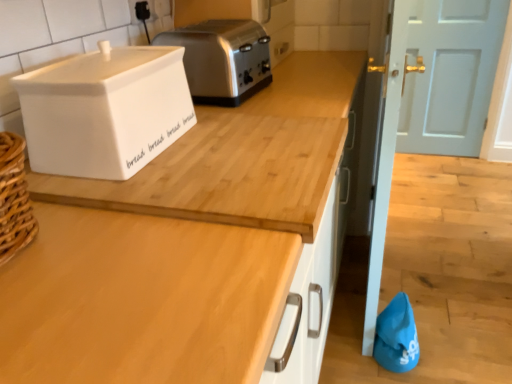
Describe the element at coordinates (222, 59) in the screenshot. I see `satin silver toaster at upper center` at that location.

What do you see at coordinates (105, 111) in the screenshot? I see `white ceramic bread bin at upper left` at bounding box center [105, 111].

Identify the location of white ceramic bread bin at upper left. (105, 111).

Find the location of `light blue painted wood door at upper right`. light blue painted wood door at upper right is located at coordinates (450, 75).

Find the location of a particular element. This screenshot has height=384, width=512. countertop in front of the light blue painted wood door at upper right is located at coordinates (190, 247).

From the image's perspective, would you say light blue painted wood door at upper right is shown under wooden at upper center?

Actually, light blue painted wood door at upper right appears above wooden at upper center in the image.

Considering the sizes of objects light blue painted wood door at upper right and wooden at upper center in the image provided, who is taller, light blue painted wood door at upper right or wooden at upper center?

Standing taller between the two is light blue painted wood door at upper right.

Is light blue painted wood door at upper right at the right side of wooden at upper center?

Yes, light blue painted wood door at upper right is to the right of wooden at upper center.

Based on the photo, considering the positions of objects white ceramic bread bin at upper left and satin silver toaster at upper center in the image provided, who is in front, white ceramic bread bin at upper left or satin silver toaster at upper center?

white ceramic bread bin at upper left.

From a real-world perspective, is white ceramic bread bin at upper left beneath satin silver toaster at upper center?

Actually, white ceramic bread bin at upper left is physically above satin silver toaster at upper center in the real world.

Does white ceramic bread bin at upper left have a lesser height compared to satin silver toaster at upper center?

No.

From the image's perspective, is satin silver toaster at upper center above light blue painted wood door at upper right?

No, from the image's perspective, satin silver toaster at upper center is not on top of light blue painted wood door at upper right.

Locate an element on the screen. door behind the satin silver toaster at upper center is located at coordinates (450, 75).

Based on the photo, considering the sizes of satin silver toaster at upper center and light blue painted wood door at upper right in the image, is satin silver toaster at upper center wider or thinner than light blue painted wood door at upper right?

Considering their sizes, satin silver toaster at upper center looks broader than light blue painted wood door at upper right.

Between light blue painted wood door at upper right and white ceramic bread bin at upper left, which one has more height?

Standing taller between the two is light blue painted wood door at upper right.

From the picture: Between light blue painted wood door at upper right and white ceramic bread bin at upper left, which one is positioned behind?

light blue painted wood door at upper right is further away from the camera.

Considering the relative positions of light blue painted wood door at upper right and white ceramic bread bin at upper left in the image provided, is light blue painted wood door at upper right to the left of white ceramic bread bin at upper left from the viewer's perspective?

In fact, light blue painted wood door at upper right is to the right of white ceramic bread bin at upper left.

Would you say wooden at upper center is inside or outside white ceramic bread bin at upper left?

wooden at upper center lies outside white ceramic bread bin at upper left.

Is wooden at upper center aimed at white ceramic bread bin at upper left?

No, wooden at upper center is not oriented towards white ceramic bread bin at upper left.

Is point (106, 252) positioned after point (68, 111)?

No.

At what (x,y) coordinates should I click in order to perform the action: click on countertop located below the white ceramic bread bin at upper left (from the image's perspective). Please return your answer as a coordinate pair (x, y). This screenshot has width=512, height=384. Looking at the image, I should click on (190, 247).

Is satin silver toaster at upper center positioned beyond the bounds of wooden at upper center?

Yes, satin silver toaster at upper center is not within wooden at upper center.

Based on the photo, does satin silver toaster at upper center appear on the left side of wooden at upper center?

Indeed, satin silver toaster at upper center is positioned on the left side of wooden at upper center.

Is satin silver toaster at upper center aimed at wooden at upper center?

No, satin silver toaster at upper center does not turn towards wooden at upper center.

Which is nearer, (249,36) or (310,237)?

Point (249,36) is positioned farther from the camera compared to point (310,237).

Choose the correct answer: Is white ceramic bread bin at upper left inside light blue painted wood door at upper right or outside it?

white ceramic bread bin at upper left is spatially situated outside light blue painted wood door at upper right.

Does white ceramic bread bin at upper left turn towards light blue painted wood door at upper right?

No, white ceramic bread bin at upper left is not oriented towards light blue painted wood door at upper right.

Based on the photo, is white ceramic bread bin at upper left at the left side of light blue painted wood door at upper right?

Yes.

This screenshot has height=384, width=512. What are the coordinates of `door that is behind the wooden at upper center` in the screenshot? It's located at (450, 75).

At what (x,y) coordinates should I click in order to perform the action: click on home appliance in front of the satin silver toaster at upper center. Please return your answer as a coordinate pair (x, y). Looking at the image, I should click on (105, 111).

Estimate the real-world distances between objects in this image. Which object is further from light blue painted wood door at upper right, white ceramic bread bin at upper left or wooden at upper center?

The object further to light blue painted wood door at upper right is white ceramic bread bin at upper left.

When comparing their distances from white ceramic bread bin at upper left, does satin silver toaster at upper center or wooden at upper center seem further?

satin silver toaster at upper center is further to white ceramic bread bin at upper left.

Consider the image. Considering their positions, is white ceramic bread bin at upper left positioned further to wooden at upper center than light blue painted wood door at upper right?

light blue painted wood door at upper right is further to wooden at upper center.

Considering their positions, is satin silver toaster at upper center positioned closer to white ceramic bread bin at upper left than light blue painted wood door at upper right?

The object closer to white ceramic bread bin at upper left is satin silver toaster at upper center.

Estimate the real-world distances between objects in this image. Which object is further from white ceramic bread bin at upper left, light blue painted wood door at upper right or satin silver toaster at upper center?

Among the two, light blue painted wood door at upper right is located further to white ceramic bread bin at upper left.

Estimate the real-world distances between objects in this image. Which object is closer to wooden at upper center, light blue painted wood door at upper right or white ceramic bread bin at upper left?

white ceramic bread bin at upper left is positioned closer to the anchor wooden at upper center.

Estimate the real-world distances between objects in this image. Which object is further from satin silver toaster at upper center, white ceramic bread bin at upper left or light blue painted wood door at upper right?

light blue painted wood door at upper right is further to satin silver toaster at upper center.

From the picture: Based on their spatial positions, is white ceramic bread bin at upper left or satin silver toaster at upper center further from wooden at upper center?

The object further to wooden at upper center is satin silver toaster at upper center.

Where is `home appliance located between wooden at upper center and light blue painted wood door at upper right in the depth direction`? The width and height of the screenshot is (512, 384). home appliance located between wooden at upper center and light blue painted wood door at upper right in the depth direction is located at coordinates (105, 111).

You are a GUI agent. You are given a task and a screenshot of the screen. Output one action in this format:
    pyautogui.click(x=<x>, y=<y>)
    Task: Click on the toaster located between white ceramic bread bin at upper left and light blue painted wood door at upper right in the depth direction
    Image resolution: width=512 pixels, height=384 pixels.
    Given the screenshot: What is the action you would take?
    pyautogui.click(x=222, y=59)

Find the location of `home appliance between wooden at upper center and satin silver toaster at upper center along the z-axis`. home appliance between wooden at upper center and satin silver toaster at upper center along the z-axis is located at coordinates (105, 111).

Image resolution: width=512 pixels, height=384 pixels. I want to click on toaster positioned between wooden at upper center and light blue painted wood door at upper right from near to far, so pyautogui.click(x=222, y=59).